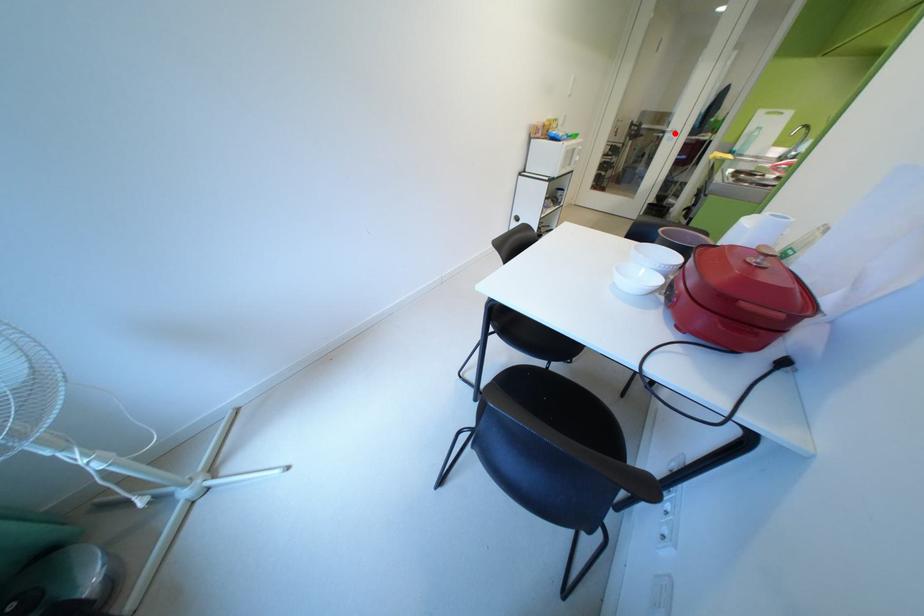
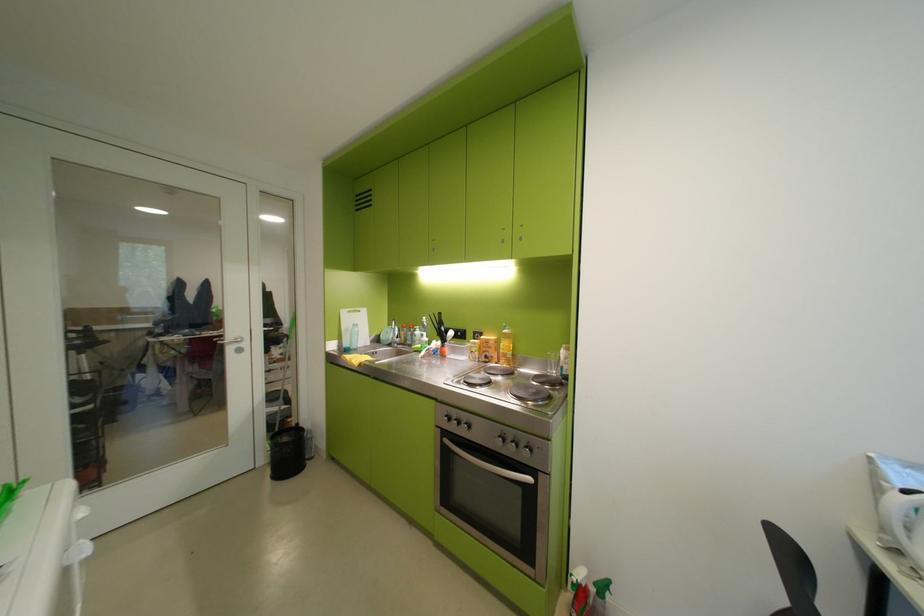
Question: I am providing you with two images of the same scene from different viewpoints. Given a red point in image1, look at the same physical point in image2. Is it:

Choices:
 (A) Closer to the viewpoint
 (B) Farther from the viewpoint

Answer: (B)